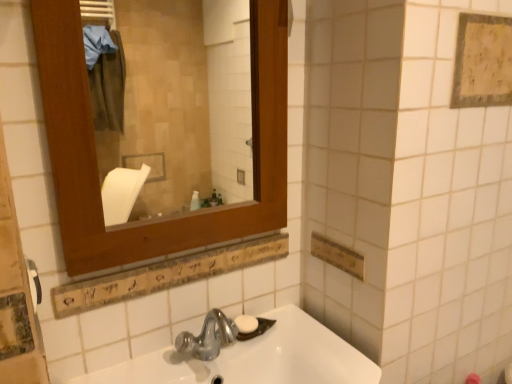
Question: Is white plastic towel bar at left further to the viewer compared to yellowish textured fabric at upper right?

Choices:
 (A) yes
 (B) no

Answer: (B)

Question: Would you say white plastic towel bar at left is outside yellowish textured fabric at upper right?

Choices:
 (A) no
 (B) yes

Answer: (B)

Question: Could you tell me if white plastic towel bar at left is turned towards yellowish textured fabric at upper right?

Choices:
 (A) yes
 (B) no

Answer: (A)

Question: Does white plastic towel bar at left have a smaller size compared to yellowish textured fabric at upper right?

Choices:
 (A) yes
 (B) no

Answer: (A)

Question: Can you confirm if white plastic towel bar at left is taller than yellowish textured fabric at upper right?

Choices:
 (A) no
 (B) yes

Answer: (A)

Question: From a real-world perspective, is white glossy sink at lower center physically located above or below wooden frame at upper left?

Choices:
 (A) above
 (B) below

Answer: (B)

Question: Is white glossy sink at lower center situated inside wooden frame at upper left or outside?

Choices:
 (A) inside
 (B) outside

Answer: (B)

Question: In the image, is white glossy sink at lower center positioned in front of or behind wooden frame at upper left?

Choices:
 (A) front
 (B) behind

Answer: (A)

Question: Considering the positions of white glossy sink at lower center and wooden frame at upper left in the image, is white glossy sink at lower center wider or thinner than wooden frame at upper left?

Choices:
 (A) wide
 (B) thin

Answer: (A)

Question: Looking at their shapes, would you say white glossy sink at lower center is wider or thinner than white plastic towel bar at left?

Choices:
 (A) thin
 (B) wide

Answer: (B)

Question: Considering the positions of white glossy sink at lower center and white plastic towel bar at left in the image, is white glossy sink at lower center taller or shorter than white plastic towel bar at left?

Choices:
 (A) tall
 (B) short

Answer: (A)

Question: Based on their positions, is white glossy sink at lower center located to the left or right of white plastic towel bar at left?

Choices:
 (A) right
 (B) left

Answer: (A)

Question: From a real-world perspective, relative to white plastic towel bar at left, is white glossy sink at lower center vertically above or below?

Choices:
 (A) below
 (B) above

Answer: (A)

Question: From their relative heights in the image, would you say white matte soap at center is taller or shorter than yellowish textured fabric at upper right?

Choices:
 (A) tall
 (B) short

Answer: (B)

Question: Is white matte soap at center inside the boundaries of yellowish textured fabric at upper right, or outside?

Choices:
 (A) inside
 (B) outside

Answer: (B)